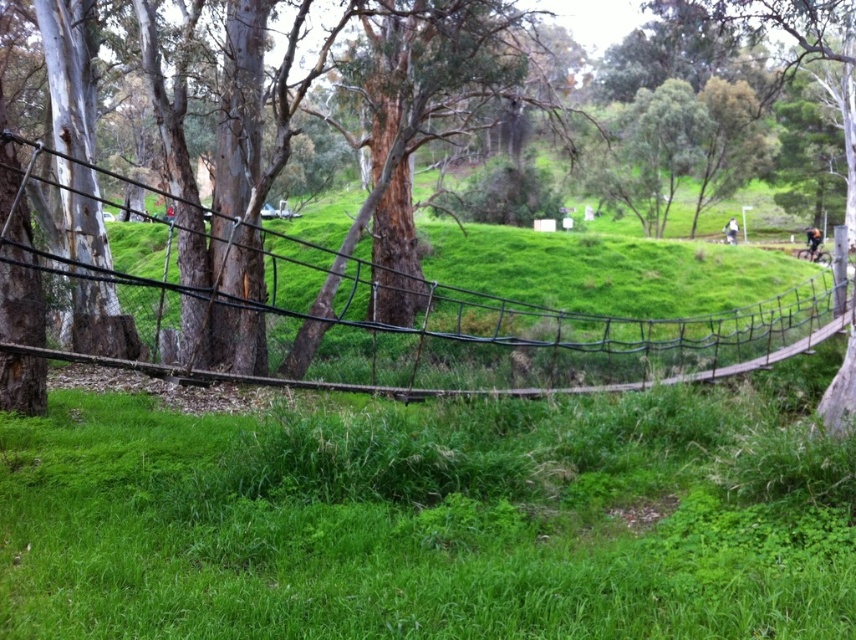
Question: Does green grassy at center have a greater width compared to black wire mesh at center?

Choices:
 (A) no
 (B) yes

Answer: (A)

Question: Can you confirm if green grassy at center is positioned below black wire mesh at center?

Choices:
 (A) no
 (B) yes

Answer: (B)

Question: Does green grassy at center appear on the left side of black wire mesh at center?

Choices:
 (A) yes
 (B) no

Answer: (B)

Question: Which of the following is the farthest from the observer?

Choices:
 (A) (282, 499)
 (B) (15, 140)

Answer: (A)